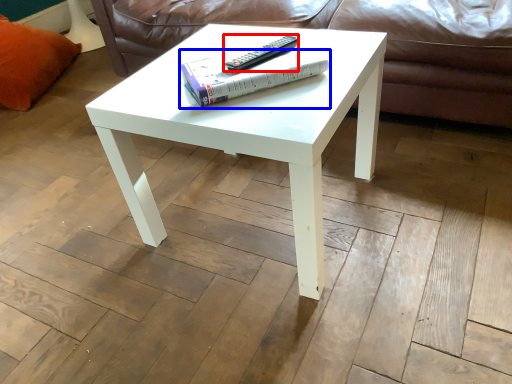
Question: Which point is further to the camera, remote (highlighted by a red box) or paperback book (highlighted by a blue box)?

Choices:
 (A) remote
 (B) paperback book

Answer: (A)